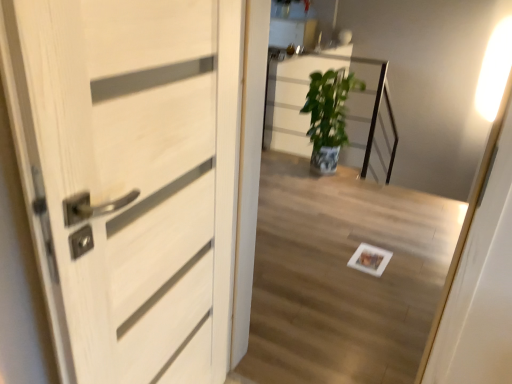
This screenshot has width=512, height=384. What are the coordinates of `green glossy plant at center` in the screenshot? It's located at (328, 116).

What do you see at coordinates (494, 70) in the screenshot? I see `white glossy light at upper right` at bounding box center [494, 70].

What do you see at coordinates (130, 178) in the screenshot?
I see `white wood door at left` at bounding box center [130, 178].

Where is `green glossy plant at center`? The image size is (512, 384). green glossy plant at center is located at coordinates (328, 116).

Between white wood door at left and green glossy plant at center, which one has less height?

green glossy plant at center is shorter.

Is white wood door at left beside green glossy plant at center?

There is a gap between white wood door at left and green glossy plant at center.

Is white wood door at left aimed at green glossy plant at center?

No, white wood door at left is not facing towards green glossy plant at center.

Based on the photo, how much distance is there between white wood door at left and green glossy plant at center?

2.70 meters.

Considering the sizes of white glossy light at upper right and white wood door at left in the image, is white glossy light at upper right wider or thinner than white wood door at left?

In the image, white glossy light at upper right appears to be more narrow than white wood door at left.

In the scene shown: Which of these two, white glossy light at upper right or white wood door at left, is smaller?

white glossy light at upper right.

Between white glossy light at upper right and white wood door at left, which one appears on the left side from the viewer's perspective?

white wood door at left is more to the left.

Can you confirm if white glossy light at upper right is shorter than white wood door at left?

Correct, white glossy light at upper right is not as tall as white wood door at left.

Who is smaller, white glossy light at upper right or green glossy plant at center?

With smaller size is white glossy light at upper right.

How many degrees apart are the facing directions of white glossy light at upper right and green glossy plant at center?

The angular difference between white glossy light at upper right and green glossy plant at center is 89.3 degrees.

Is white glossy light at upper right positioned in front of green glossy plant at center?

That is False.

Consider the image. Considering the relative sizes of green glossy plant at center and white glossy light at upper right in the image provided, is green glossy plant at center thinner than white glossy light at upper right?

No.

From a real-world perspective, who is located higher, green glossy plant at center or white glossy light at upper right?

white glossy light at upper right, from a real-world perspective.

Considering the positions of objects green glossy plant at center and white glossy light at upper right in the image provided, who is more to the right, green glossy plant at center or white glossy light at upper right?

Positioned to the right is white glossy light at upper right.

From the image's perspective, which object appears higher, green glossy plant at center or white glossy light at upper right?

white glossy light at upper right appears higher in the image.

Identify the location of door lying in front of the white glossy light at upper right. Image resolution: width=512 pixels, height=384 pixels. (130, 178).

Can you tell me how much white wood door at left and white glossy light at upper right differ in facing direction?

The angular difference between white wood door at left and white glossy light at upper right is 179 degrees.

Are white wood door at left and white glossy light at upper right far apart?

Absolutely, white wood door at left is distant from white glossy light at upper right.

Between green glossy plant at center and white wood door at left, which one appears on the left side from the viewer's perspective?

white wood door at left is more to the left.

Is green glossy plant at center outside of white wood door at left?

Yes, green glossy plant at center is outside of white wood door at left.

Is green glossy plant at center touching white wood door at left?

No, green glossy plant at center is not touching white wood door at left.

From a real-world perspective, who is located lower, green glossy plant at center or white wood door at left?

green glossy plant at center.

In order to click on houseplant on the right of white wood door at left in this screenshot , I will do `click(328, 116)`.

Locate an element on the screen. light above the white wood door at left (from the image's perspective) is located at coordinates (494, 70).

Which object lies nearer to the anchor point white wood door at left, white glossy light at upper right or green glossy plant at center?

green glossy plant at center is closer to white wood door at left.

Looking at the image, which one is located further to white glossy light at upper right, green glossy plant at center or white wood door at left?

white wood door at left is positioned further to the anchor white glossy light at upper right.

Based on their spatial positions, is white glossy light at upper right or white wood door at left further from green glossy plant at center?

white wood door at left.

In the scene shown: Estimate the real-world distances between objects in this image. Which object is closer to green glossy plant at center, white wood door at left or white glossy light at upper right?

white glossy light at upper right.

Estimate the real-world distances between objects in this image. Which object is closer to white wood door at left, green glossy plant at center or white glossy light at upper right?

green glossy plant at center is positioned closer to the anchor white wood door at left.

Considering their positions, is white wood door at left positioned further to white glossy light at upper right than green glossy plant at center?

Based on the image, white wood door at left appears to be further to white glossy light at upper right.

Where is `houseplant between white wood door at left and white glossy light at upper right from front to back`? houseplant between white wood door at left and white glossy light at upper right from front to back is located at coordinates (328, 116).